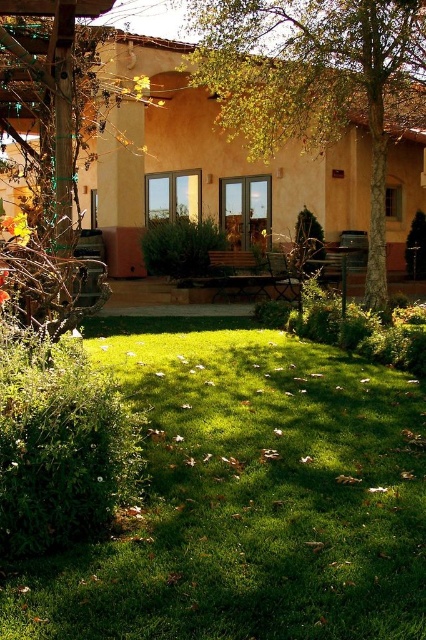
Which is below, green grass at center or brown textured tree at center?

green grass at center is below.

Does green grass at center appear under brown textured tree at center?

Yes, green grass at center is below brown textured tree at center.

Who is more forward, (54,577) or (379,193)?

Point (54,577)

Find the location of a particular element. green grass at center is located at coordinates (249, 497).

Is green grass at center bigger than brown textured tree at left?

Actually, green grass at center might be smaller than brown textured tree at left.

At what (x,y) coordinates should I click in order to perform the action: click on green grass at center. Please return your answer as a coordinate pair (x, y). The width and height of the screenshot is (426, 640). Looking at the image, I should click on (249, 497).

Is brown textured tree at center shorter than brown textured tree at left?

Indeed, brown textured tree at center has a lesser height compared to brown textured tree at left.

Is brown textured tree at center below brown textured tree at left?

Incorrect, brown textured tree at center is not positioned below brown textured tree at left.

Locate an element on the screen. brown textured tree at center is located at coordinates (316, 81).